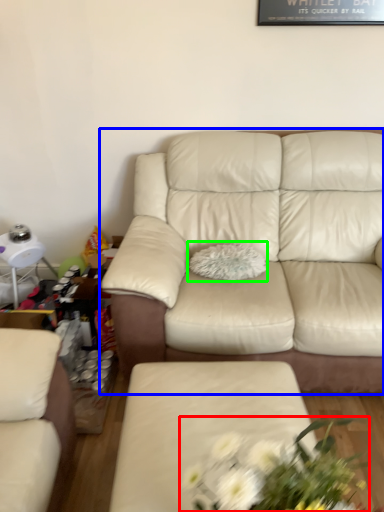
Question: Considering the real-world distances, which object is closest to floral arrangement (highlighted by a red box)? studio couch (highlighted by a blue box) or pillow (highlighted by a green box).

Choices:
 (A) studio couch
 (B) pillow

Answer: (A)